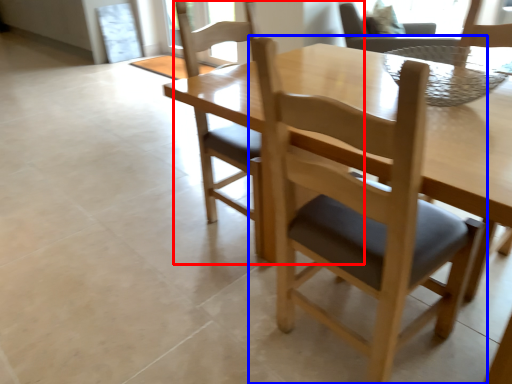
Question: Which point is further to the camera, chair (highlighted by a red box) or chair (highlighted by a blue box)?

Choices:
 (A) chair
 (B) chair

Answer: (A)